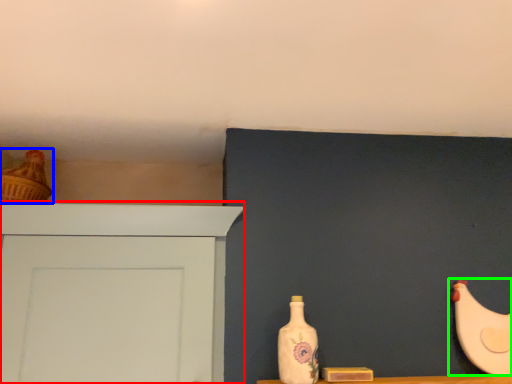
Question: Which object is the farthest from door (highlighted by a red box)? Choose among these: chicken (highlighted by a blue box) or chicken (highlighted by a green box).

Choices:
 (A) chicken
 (B) chicken

Answer: (B)